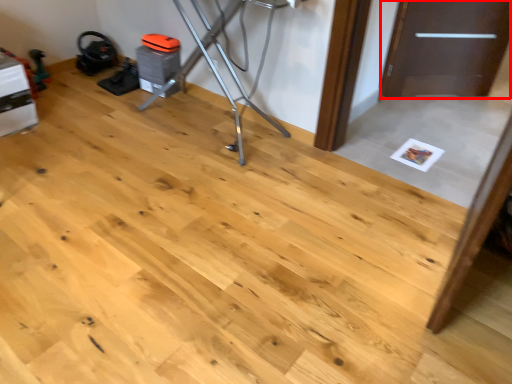
Question: From the image, what is the correct spatial relationship of door (annotated by the red box) in relation to furniture?

Choices:
 (A) right
 (B) left

Answer: (A)